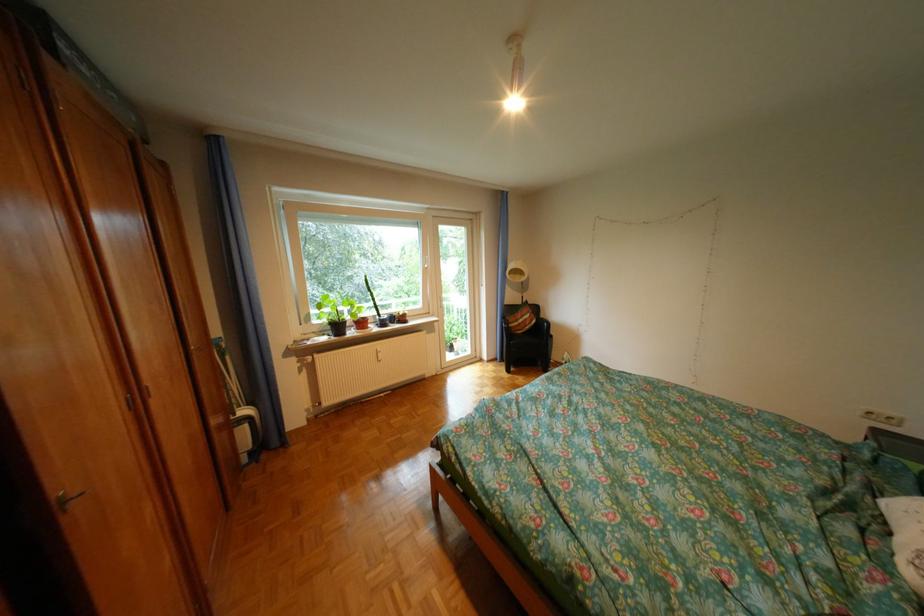
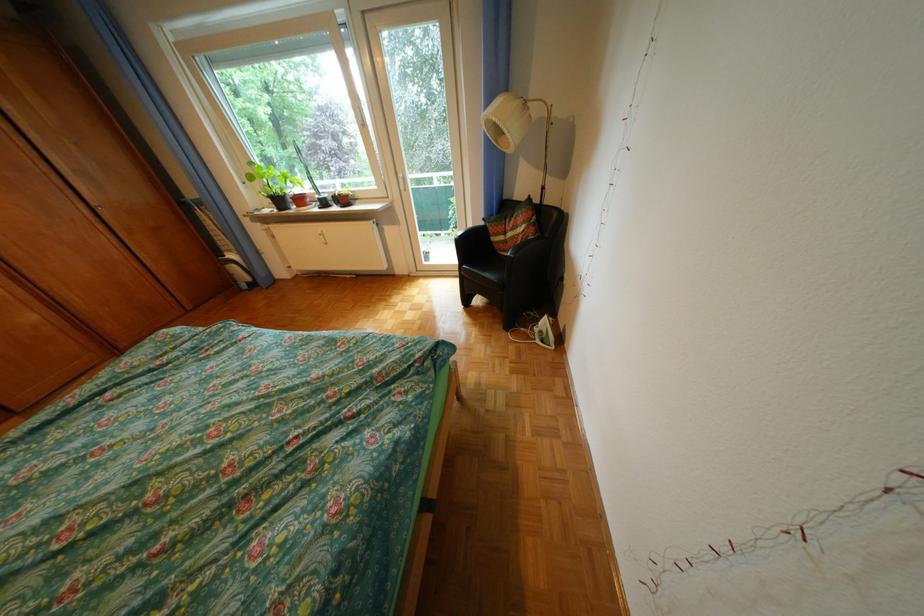
The point at (x=535, y=322) is marked in the first image. Where is the corresponding point in the second image?

(524, 236)